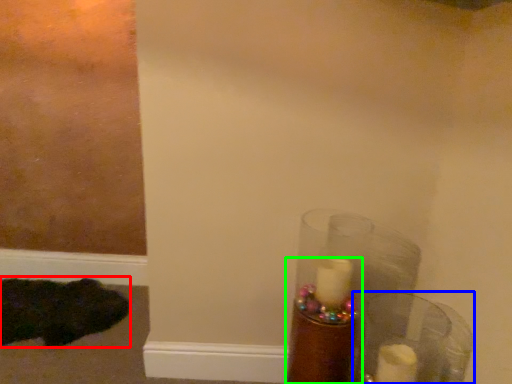
Question: Estimate the real-world distances between objects in this image. Which object is farther from animal (highlighted by a red box), glass vase (highlighted by a blue box) or candle holder (highlighted by a green box)?

Choices:
 (A) glass vase
 (B) candle holder

Answer: (A)